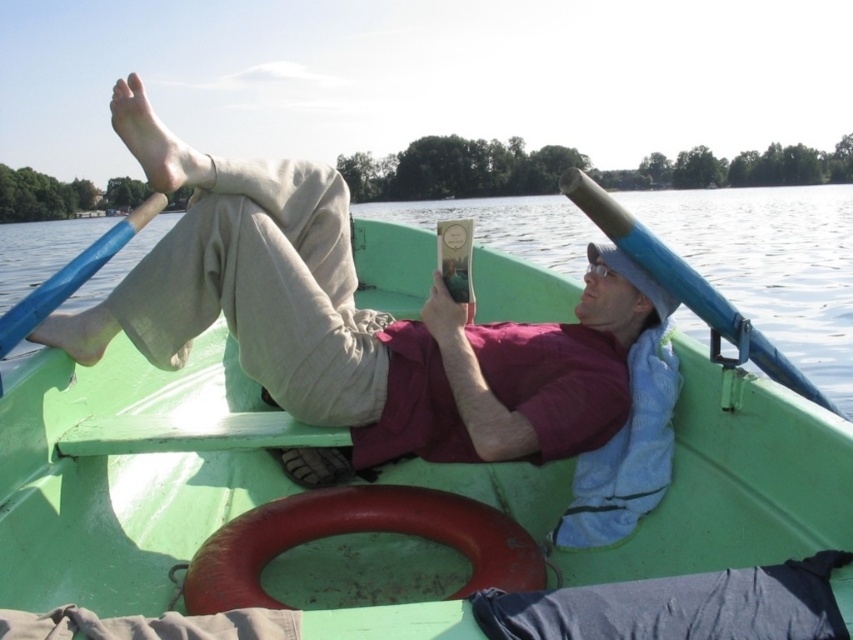
Based on the photo, you are a photographer trying to capture the scene of the green matte boat at center and the matte khaki pants at center. From your current position, can you see both objects clearly without any obstruction?

The green matte boat at center is in front of the matte khaki pants at center, so the boat may block the view of the pants depending on your angle. Adjust your position to ensure both are visible.

What is the spatial relationship between the green matte boat at center and the matte khaki pants at center?

The green matte boat at center is positioned on the right side of matte khaki pants at center.